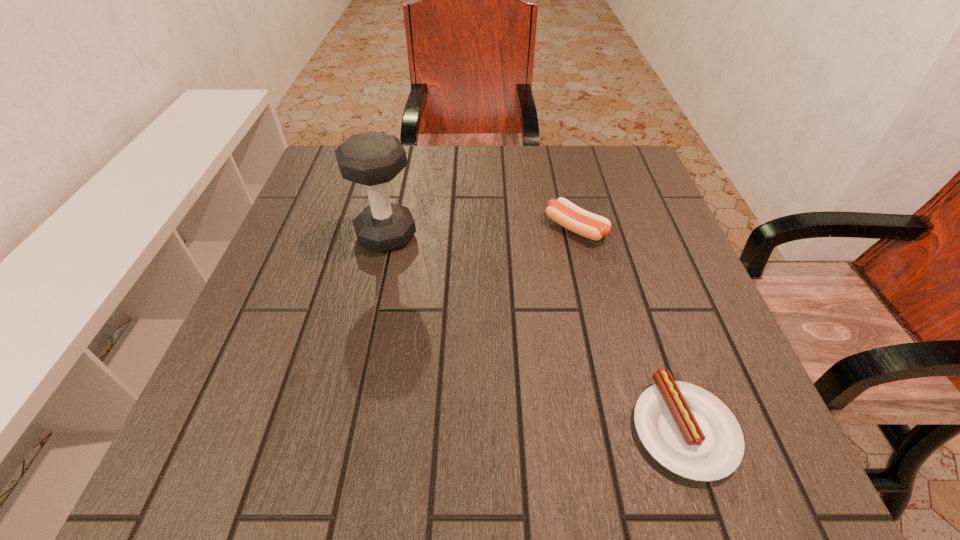
Locate an element on the screen. the leftmost object is located at coordinates (373, 158).

You are a GUI agent. You are given a task and a screenshot of the screen. Output one action in this format:
    pyautogui.click(x=<x>, y=<y>)
    Task: Click on the tallest object
    The width and height of the screenshot is (960, 540).
    Given the screenshot: What is the action you would take?
    pyautogui.click(x=373, y=158)

Locate an element on the screen. Image resolution: width=960 pixels, height=540 pixels. the second tallest object is located at coordinates (592, 226).

You are a GUI agent. You are given a task and a screenshot of the screen. Output one action in this format:
    pyautogui.click(x=<x>, y=<y>)
    Task: Click on the farther sausage
    
    Given the screenshot: What is the action you would take?
    pyautogui.click(x=592, y=226)

Find the location of a particular element. Image resolution: width=960 pixels, height=540 pixels. the shorter sausage is located at coordinates (688, 430).

The width and height of the screenshot is (960, 540). What are the coordinates of `the shortest object` in the screenshot? It's located at (688, 430).

This screenshot has width=960, height=540. Identify the location of free space located 0.150m on the back of the dumbbell. (399, 180).

Where is `vacant space located on the left of the second shortest object`? The height and width of the screenshot is (540, 960). vacant space located on the left of the second shortest object is located at coordinates click(x=501, y=228).

Find the location of a particular element. free space located on the left of the shortest object is located at coordinates pyautogui.click(x=459, y=428).

Find the location of a particular element. This screenshot has height=540, width=960. object that is at the near edge is located at coordinates (688, 430).